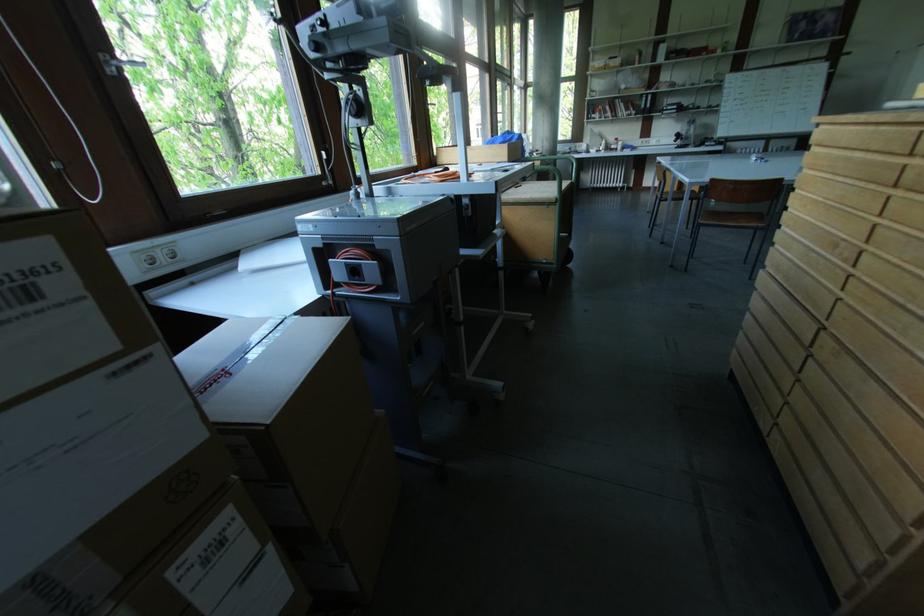
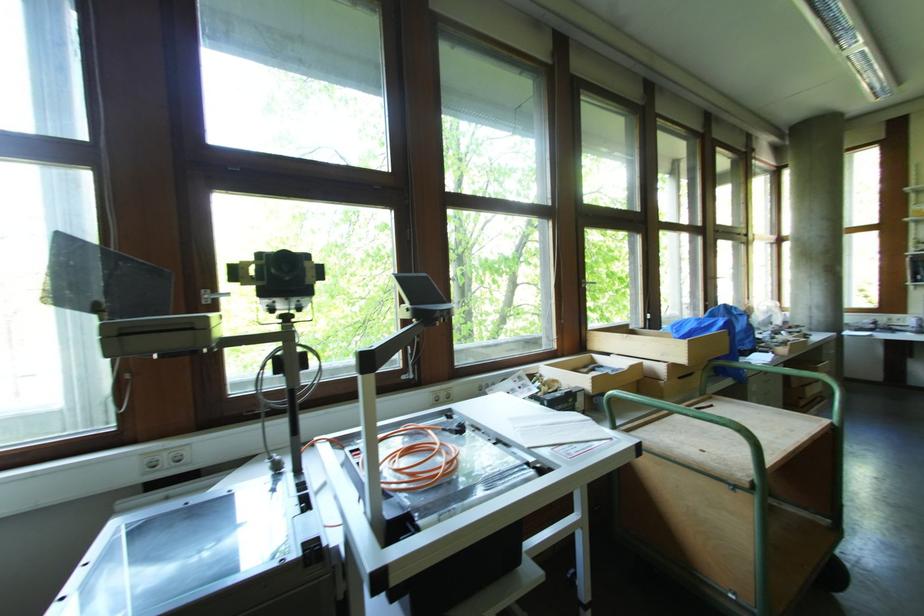
Where in the second image is the point corresponding to [575,184] from the first image?

(834, 426)